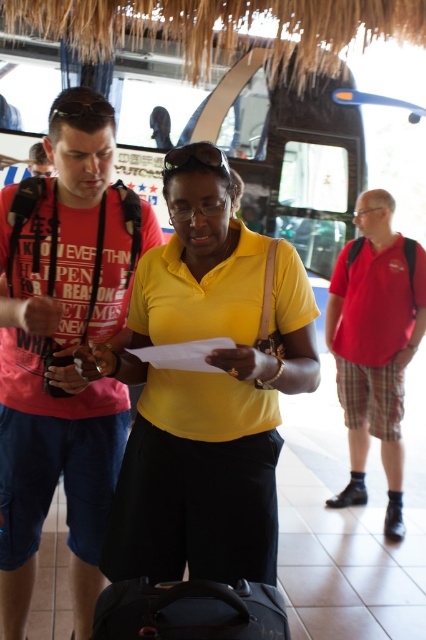
Is yellow matte shirt at center bigger than matte red t-shirt at left?

Actually, yellow matte shirt at center might be smaller than matte red t-shirt at left.

From the picture: Can you confirm if yellow matte shirt at center is positioned to the right of matte red t-shirt at left?

Yes, yellow matte shirt at center is to the right of matte red t-shirt at left.

Between point (298, 301) and point (63, 323), which one is positioned behind?

Point (63, 323)

I want to click on yellow matte shirt at center, so click(x=204, y=390).

What do you see at coordinates (63, 348) in the screenshot?
I see `matte red t-shirt at left` at bounding box center [63, 348].

Does matte red t-shirt at left appear under red plaid shorts at right?

Correct, matte red t-shirt at left is located below red plaid shorts at right.

Who is more distant from viewer, (54, 387) or (357, 497)?

The point (357, 497) is more distant.

Where is `matte red t-shirt at left`? The width and height of the screenshot is (426, 640). matte red t-shirt at left is located at coordinates (63, 348).

Locate an element on the screen. This screenshot has height=640, width=426. yellow matte shirt at center is located at coordinates point(204,390).

Measure the distance between point (x=247, y=513) and camera.

A distance of 5.63 feet exists between point (x=247, y=513) and camera.

Between point (184, 531) and point (388, 408), which one is positioned behind?

Positioned behind is point (388, 408).

At what (x,y) coordinates should I click in order to perform the action: click on yellow matte shirt at center. Please return your answer as a coordinate pair (x, y). The width and height of the screenshot is (426, 640). Looking at the image, I should click on (204, 390).